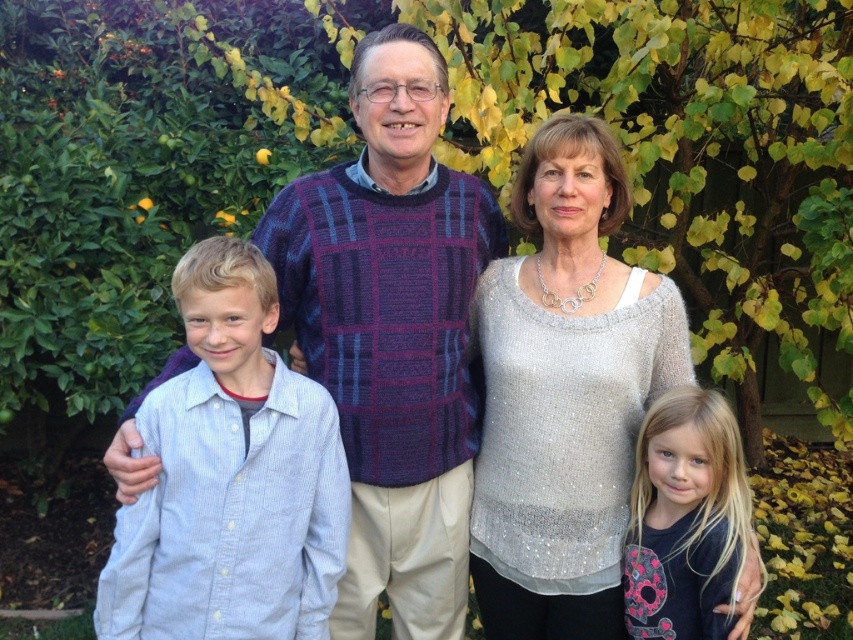
Can you confirm if silver sequined top at center is taller than light blue striped shirt at center?

Yes, silver sequined top at center is taller than light blue striped shirt at center.

Which of these two, silver sequined top at center or light blue striped shirt at center, stands taller?

Standing taller between the two is silver sequined top at center.

The width and height of the screenshot is (853, 640). Describe the element at coordinates (564, 394) in the screenshot. I see `silver sequined top at center` at that location.

At what (x,y) coordinates should I click in order to perform the action: click on silver sequined top at center. Please return your answer as a coordinate pair (x, y). Looking at the image, I should click on (564, 394).

Does plaid sweater at center appear on the right side of blonde hair at center?

No, plaid sweater at center is not to the right of blonde hair at center.

Is point (370, 173) in front of point (624, 561)?

No, it is not.

I want to click on plaid sweater at center, so click(x=392, y=333).

Which of these two, silver sequined top at center or blonde hair at center, stands shorter?

blonde hair at center is shorter.

Is silver sequined top at center to the left of blonde hair at center from the viewer's perspective?

Yes, silver sequined top at center is to the left of blonde hair at center.

Between point (618, 563) and point (660, 528), which one is positioned behind?

The point (618, 563) is more distant.

The width and height of the screenshot is (853, 640). What are the coordinates of `silver sequined top at center` in the screenshot? It's located at (564, 394).